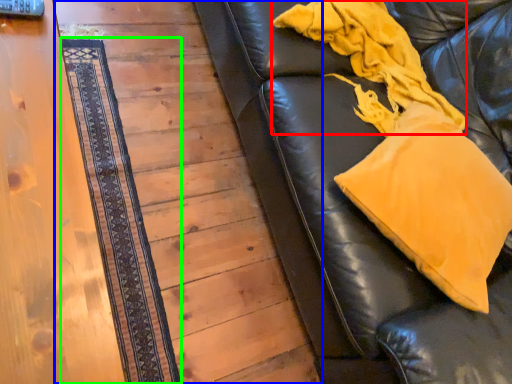
Question: Which is farther away from blanket (highlighted by a red box)? panel (highlighted by a blue box) or mat (highlighted by a green box)?

Choices:
 (A) panel
 (B) mat

Answer: (B)